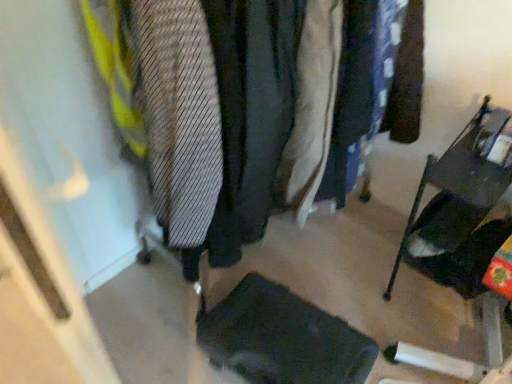
This screenshot has width=512, height=384. In order to click on blank area to the left of metallic dark gray folding chair at right in this screenshot , I will do `click(359, 286)`.